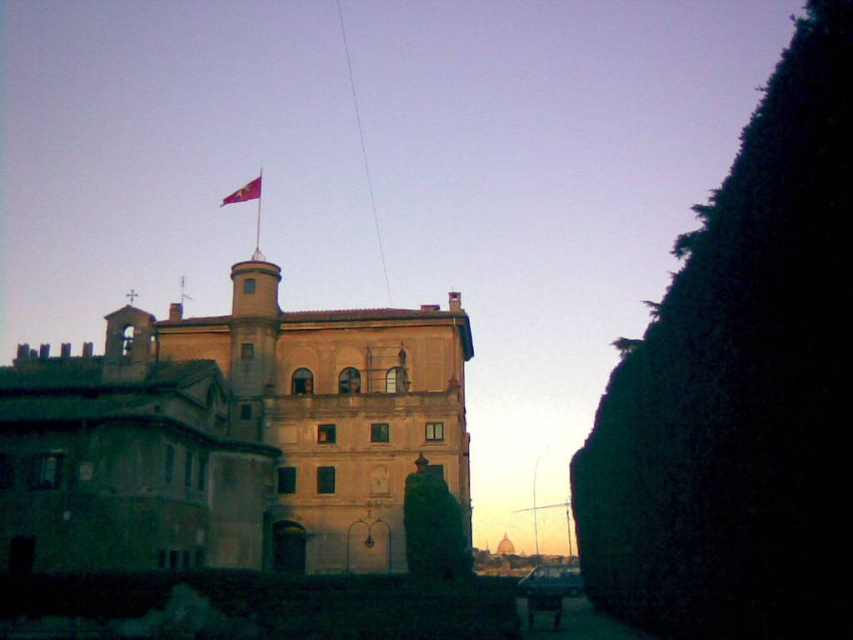
You are a photographer standing in front of the historic building. You want to take a picture that includes both the beige stone palace at center and the red fabric flag at top center. Based on their positions, which object should you adjust your camera angle to capture first?

The beige stone palace at center is positioned on the right side of the red fabric flag at top center, so you should adjust your camera angle to capture the red fabric flag at top center first before framing the beige stone palace at center to include both in the shot.

You are standing in front of the historic building and want to take a photo. You notice two points marked on your map at coordinates point (x=3, y=433) and point (x=224, y=200). Which point is closer to you, the photographer, so that you can frame the historic building better?

Point (x=3, y=433) is closer to the viewer than point (x=224, y=200), so you should position yourself at point (x=3, y=433) to frame the historic building better.

You are standing at point A, which is located at coordinates 0.3, 0.3. You want to walk directly towards the beige stone palace at center. What direction should you move in relative to your current position?

Since the beige stone palace at center is located at point (233, 436) and you are at point (254, 192), you should move northeast to reach it.